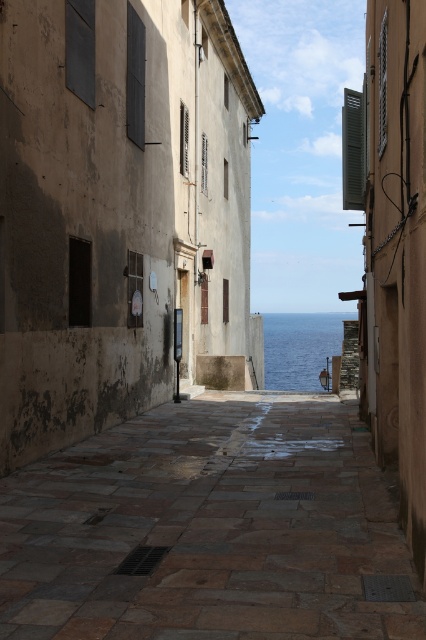
Which is above, green painted wood shutter at upper right or brown wooden shutter at upper center?

Positioned higher is green painted wood shutter at upper right.

Which of these two, green painted wood shutter at upper right or brown wooden shutter at upper center, stands taller?

Standing taller between the two is green painted wood shutter at upper right.

Is point (348, 92) farther from viewer compared to point (203, 154)?

That is False.

Identify the location of green painted wood shutter at upper right. Image resolution: width=426 pixels, height=640 pixels. (353, 150).

Is point (373, 605) positioned behind point (74, 20)?

No, it is not.

Is stone paved path at center above black matte shutter at upper left?

No.

What are the coordinates of `stone paved path at center` in the screenshot? It's located at (207, 528).

Is black matte shutter at upper left to the right of wooden textured shutter at upper center from the viewer's perspective?

In fact, black matte shutter at upper left is to the left of wooden textured shutter at upper center.

Measure the distance between black matte shutter at upper left and wooden textured shutter at upper center.

7.22 meters

Who is more forward, (x=86, y=93) or (x=181, y=141)?

Positioned in front is point (x=86, y=93).

I want to click on black matte shutter at upper left, so click(80, 49).